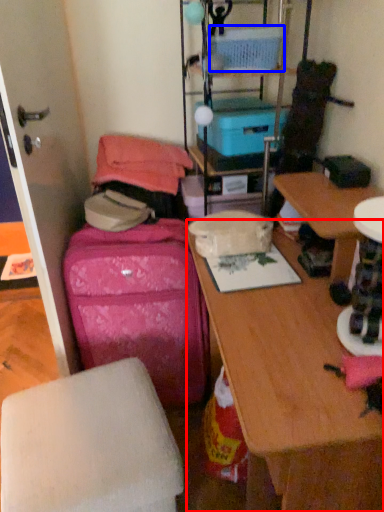
Question: Which object appears closest to the camera in this image, desk (highlighted by a red box) or storage box (highlighted by a blue box)?

Choices:
 (A) desk
 (B) storage box

Answer: (A)